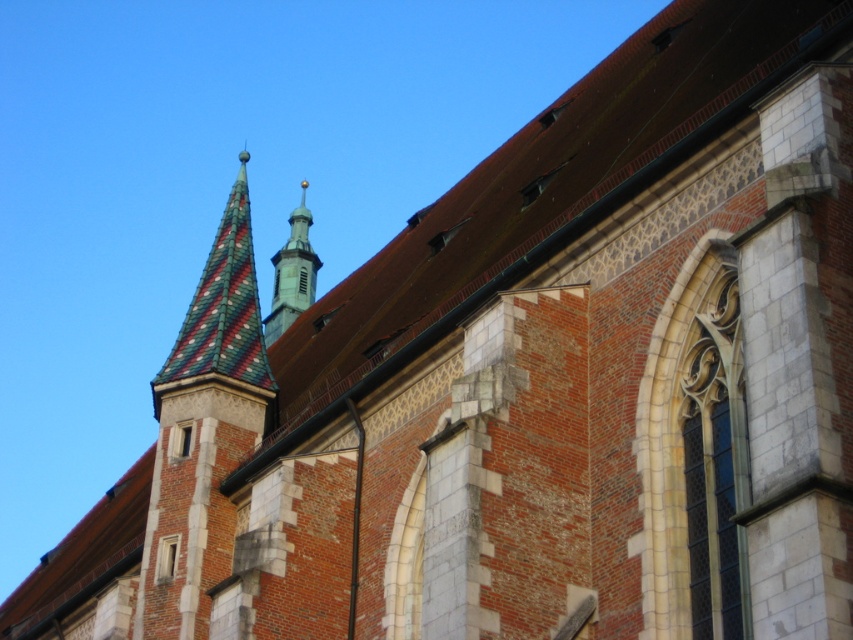
Question: Which point is farther to the camera?

Choices:
 (A) (233, 186)
 (B) (300, 230)

Answer: (B)

Question: Is multicolored tiled spire at upper left behind smooth gold spire at center?

Choices:
 (A) yes
 (B) no

Answer: (B)

Question: Does multicolored tiled spire at upper left come behind smooth gold spire at center?

Choices:
 (A) yes
 (B) no

Answer: (B)

Question: Which point appears closest to the camera in this image?

Choices:
 (A) 305,257
 (B) 241,282

Answer: (B)

Question: Which object is closer to the camera taking this photo?

Choices:
 (A) smooth gold spire at center
 (B) multicolored tiled spire at upper left

Answer: (B)

Question: Is multicolored tiled spire at upper left thinner than smooth gold spire at center?

Choices:
 (A) no
 (B) yes

Answer: (B)